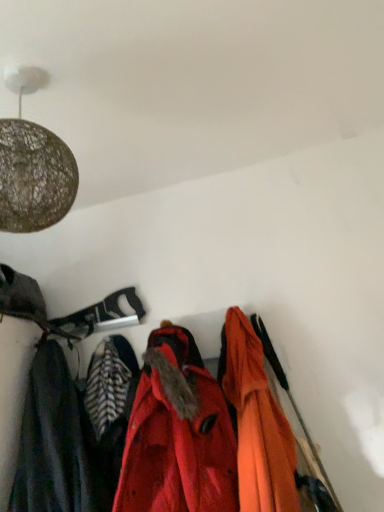
Question: Which direction should I rotate to face red matte jacket at center, placed as the first jacket when sorted from left to right, — up or down?

Choices:
 (A) down
 (B) up

Answer: (A)

Question: Considering the relative sizes of dark gray fabric at left and orange matte jacket at center, the 1th jacket positioned from the right, in the image provided, is dark gray fabric at left smaller than orange matte jacket at center, the 1th jacket positioned from the right,?

Choices:
 (A) yes
 (B) no

Answer: (A)

Question: Considering the relative positions of dark gray fabric at left and orange matte jacket at center, positioned as the second jacket in left-to-right order, in the image provided, is dark gray fabric at left to the right of orange matte jacket at center, positioned as the second jacket in left-to-right order, from the viewer's perspective?

Choices:
 (A) no
 (B) yes

Answer: (A)

Question: Is dark gray fabric at left oriented towards orange matte jacket at center, the 1th jacket positioned from the right?

Choices:
 (A) no
 (B) yes

Answer: (A)

Question: Is dark gray fabric at left taller than orange matte jacket at center, positioned as the second jacket in left-to-right order?

Choices:
 (A) yes
 (B) no

Answer: (B)

Question: Is orange matte jacket at center, the 1th jacket positioned from the right, at the back of dark gray fabric at left?

Choices:
 (A) yes
 (B) no

Answer: (B)

Question: From a real-world perspective, is dark gray fabric at left over orange matte jacket at center, positioned as the second jacket in left-to-right order?

Choices:
 (A) yes
 (B) no

Answer: (A)

Question: Is red matte jacket at center, placed as the first jacket when sorted from left to right, positioned before dark gray fabric at left?

Choices:
 (A) no
 (B) yes

Answer: (B)

Question: Is red matte jacket at center, the 2th jacket positioned from the right, behind dark gray fabric at left?

Choices:
 (A) yes
 (B) no

Answer: (B)

Question: Considering the relative sizes of red matte jacket at center, the 2th jacket positioned from the right, and dark gray fabric at left in the image provided, is red matte jacket at center, the 2th jacket positioned from the right, wider than dark gray fabric at left?

Choices:
 (A) no
 (B) yes

Answer: (B)

Question: From a real-world perspective, is red matte jacket at center, the 2th jacket positioned from the right, located beneath dark gray fabric at left?

Choices:
 (A) no
 (B) yes

Answer: (B)

Question: Is dark gray fabric at left surrounded by red matte jacket at center, placed as the first jacket when sorted from left to right?

Choices:
 (A) no
 (B) yes

Answer: (A)

Question: Considering the relative positions of red matte jacket at center, placed as the first jacket when sorted from left to right, and dark gray fabric at left in the image provided, is red matte jacket at center, placed as the first jacket when sorted from left to right, to the right of dark gray fabric at left from the viewer's perspective?

Choices:
 (A) no
 (B) yes

Answer: (B)

Question: Does red matte jacket at center, the 2th jacket positioned from the right, come in front of orange matte jacket at center, positioned as the second jacket in left-to-right order?

Choices:
 (A) no
 (B) yes

Answer: (B)